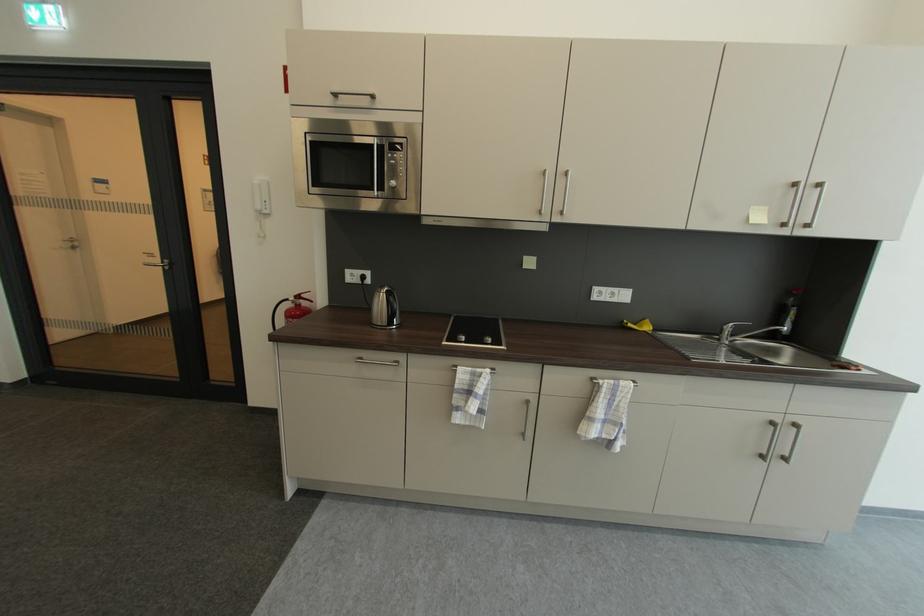
Locate an element on the screen. The width and height of the screenshot is (924, 616). sink faucet handle is located at coordinates (730, 330).